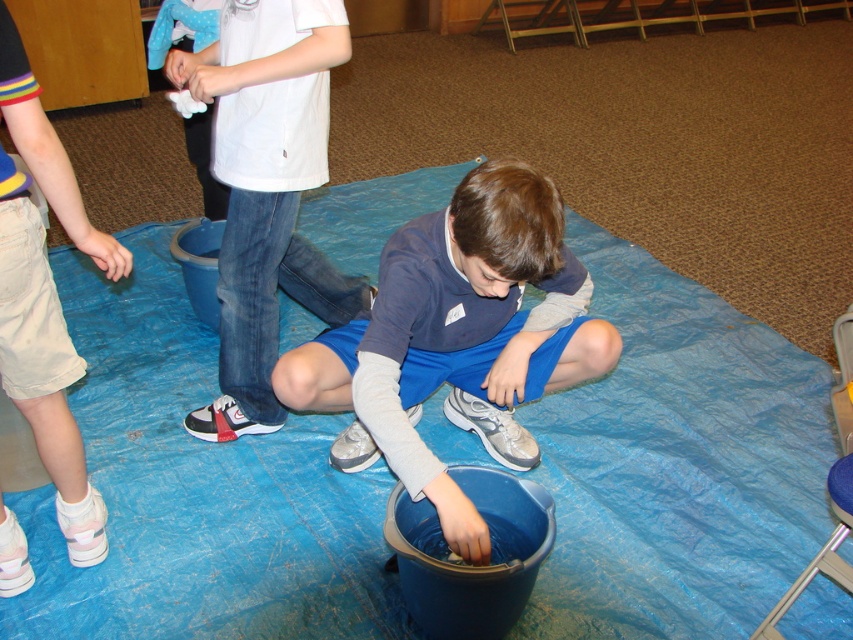
Question: Can you confirm if blue fabric shorts at center is positioned below white matte shirt at upper center?

Choices:
 (A) no
 (B) yes

Answer: (B)

Question: Which point is farther to the camera?

Choices:
 (A) (302, 122)
 (B) (611, 328)

Answer: (A)

Question: Does blue fabric shorts at center have a smaller size compared to white matte shirt at upper center?

Choices:
 (A) no
 (B) yes

Answer: (A)

Question: Is blue fabric shorts at center positioned in front of white matte shirt at upper center?

Choices:
 (A) no
 (B) yes

Answer: (B)